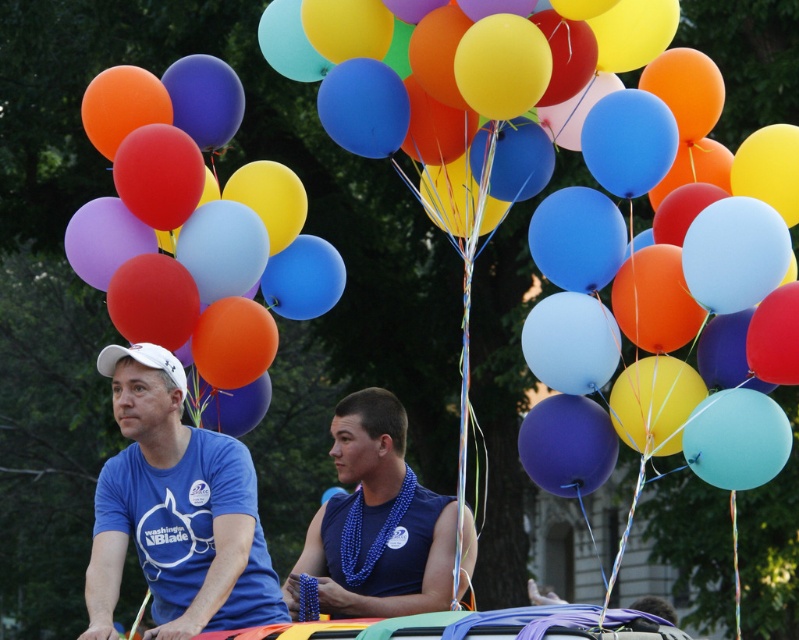
You are standing at the camera position and want to reach the point marked at point (714, 224). If you walk straight ahead, will you reach that point?

The point marked at point (714, 224) is 52.18 meters away from the camera, so if you walk straight ahead, you will eventually reach that point after covering the distance.

In the scene shown: You are a photographer at the parade and want to take a photo of both the matte blue balloon at center and the blue beaded necklace at center. Which object will appear larger in your photo?

The matte blue balloon at center will appear larger in the photo because it is closer to the viewer than the blue beaded necklace at center.

What are the coordinates of the matte blue balloon at center?

The coordinates of the matte blue balloon at center are at point (586,202).